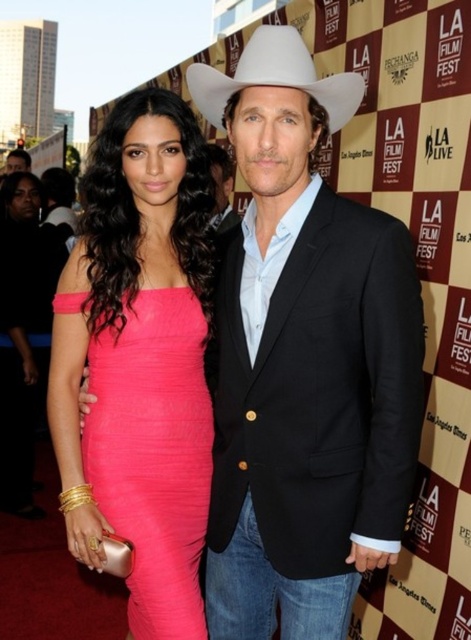
Does pink satin clutch at lower left appear on the right side of white matte fedora at upper center?

Incorrect, pink satin clutch at lower left is not on the right side of white matte fedora at upper center.

This screenshot has width=471, height=640. What do you see at coordinates (23, 332) in the screenshot? I see `pink satin clutch at lower left` at bounding box center [23, 332].

The height and width of the screenshot is (640, 471). Identify the location of pink satin clutch at lower left. (23, 332).

Is pink ribbed dress at center wider than pink satin clutch at lower left?

Correct, the width of pink ribbed dress at center exceeds that of pink satin clutch at lower left.

Can you confirm if pink ribbed dress at center is smaller than pink satin clutch at lower left?

Yes, pink ribbed dress at center is smaller than pink satin clutch at lower left.

I want to click on pink ribbed dress at center, so click(154, 454).

Which is above, pink ribbed dress at center or white matte fedora at upper center?

white matte fedora at upper center is above.

Find the location of a particular element. This screenshot has height=640, width=471. pink ribbed dress at center is located at coordinates (154, 454).